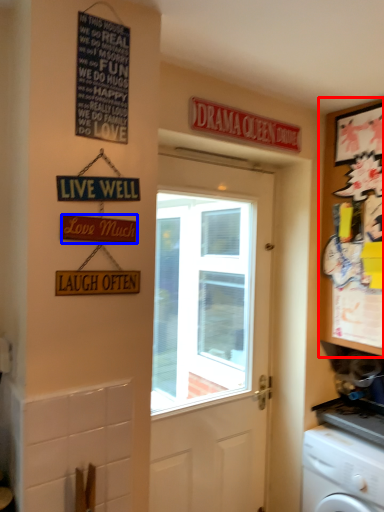
Question: Which object appears closest to the camera in this image, cabinetry (highlighted by a red box) or parking sign (highlighted by a blue box)?

Choices:
 (A) cabinetry
 (B) parking sign

Answer: (B)